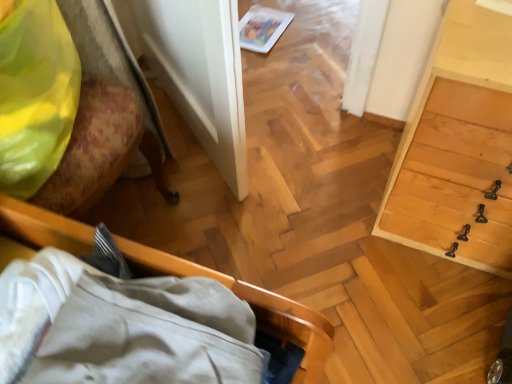
Question: Is point (245, 284) positioned closer to the camera than point (42, 72)?

Choices:
 (A) farther
 (B) closer

Answer: (B)

Question: From the image's perspective, is wooden bed frame at lower left, the second furniture in the left-to-right sequence, above or below matte yellow fabric at upper left?

Choices:
 (A) below
 (B) above

Answer: (A)

Question: Which of these objects is positioned farthest from the matte yellow fabric at upper left?

Choices:
 (A) white glossy magazine at upper center
 (B) light wood dresser at right
 (C) wooden chair at left, positioned as the second furniture in right-to-left order
 (D) wooden bed frame at lower left, which ranks as the first furniture in right-to-left order

Answer: (A)

Question: Which object is positioned farthest from the matte yellow fabric at upper left?

Choices:
 (A) wooden bed frame at lower left, which ranks as the first furniture in right-to-left order
 (B) white glossy magazine at upper center
 (C) light wood dresser at right
 (D) wooden chair at left, positioned as the second furniture in right-to-left order

Answer: (B)